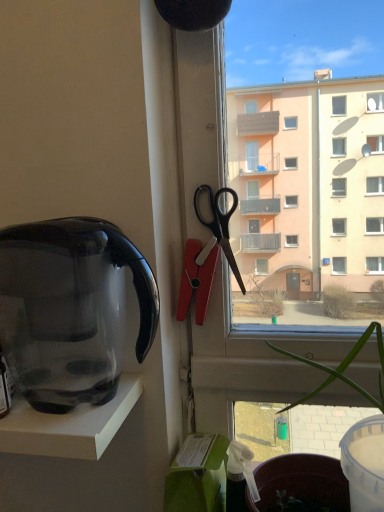
Question: Would you consider transparent plastic kettle at left to be distant from green leafy plant at center?

Choices:
 (A) no
 (B) yes

Answer: (A)

Question: Does transparent plastic kettle at left have a lesser height compared to green leafy plant at center?

Choices:
 (A) no
 (B) yes

Answer: (B)

Question: Is transparent plastic kettle at left facing towards green leafy plant at center?

Choices:
 (A) yes
 (B) no

Answer: (B)

Question: Is transparent plastic kettle at left closer to camera compared to green leafy plant at center?

Choices:
 (A) yes
 (B) no

Answer: (B)

Question: Is transparent plastic kettle at left looking in the opposite direction of green leafy plant at center?

Choices:
 (A) yes
 (B) no

Answer: (A)

Question: Can you confirm if transparent plastic kettle at left is positioned to the right of green leafy plant at center?

Choices:
 (A) yes
 (B) no

Answer: (B)

Question: Does black plastic scissors at upper right lie behind transparent plastic kettle at left?

Choices:
 (A) yes
 (B) no

Answer: (A)

Question: Would you say transparent plastic kettle at left is part of black plastic scissors at upper right's contents?

Choices:
 (A) no
 (B) yes

Answer: (A)

Question: Is black plastic scissors at upper right beside transparent plastic kettle at left?

Choices:
 (A) yes
 (B) no

Answer: (B)

Question: Can you confirm if black plastic scissors at upper right is smaller than transparent plastic kettle at left?

Choices:
 (A) yes
 (B) no

Answer: (A)

Question: Considering the relative positions of black plastic scissors at upper right and transparent plastic kettle at left in the image provided, is black plastic scissors at upper right to the left of transparent plastic kettle at left from the viewer's perspective?

Choices:
 (A) no
 (B) yes

Answer: (A)

Question: Does black plastic scissors at upper right have a lesser height compared to transparent plastic kettle at left?

Choices:
 (A) yes
 (B) no

Answer: (A)

Question: Is green leafy plant at center located outside black plastic scissors at upper right?

Choices:
 (A) yes
 (B) no

Answer: (A)